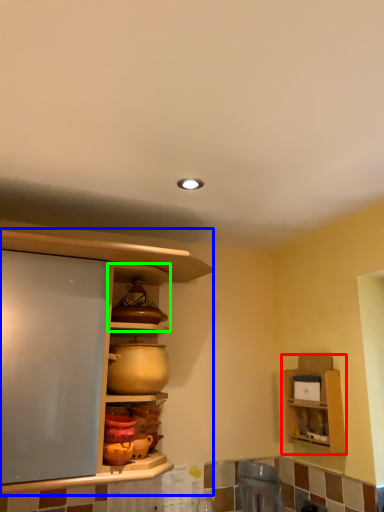
Question: Considering the real-world distances, which object is farthest from shelf (highlighted by a red box)? cabinetry (highlighted by a blue box) or cabinet (highlighted by a green box)?

Choices:
 (A) cabinetry
 (B) cabinet

Answer: (A)